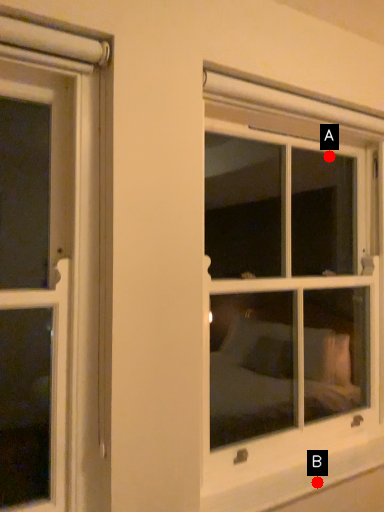
Question: Two points are circled on the image, labeled by A and B beside each circle. Which point is farther from the camera taking this photo?

Choices:
 (A) A is further
 (B) B is further

Answer: (A)